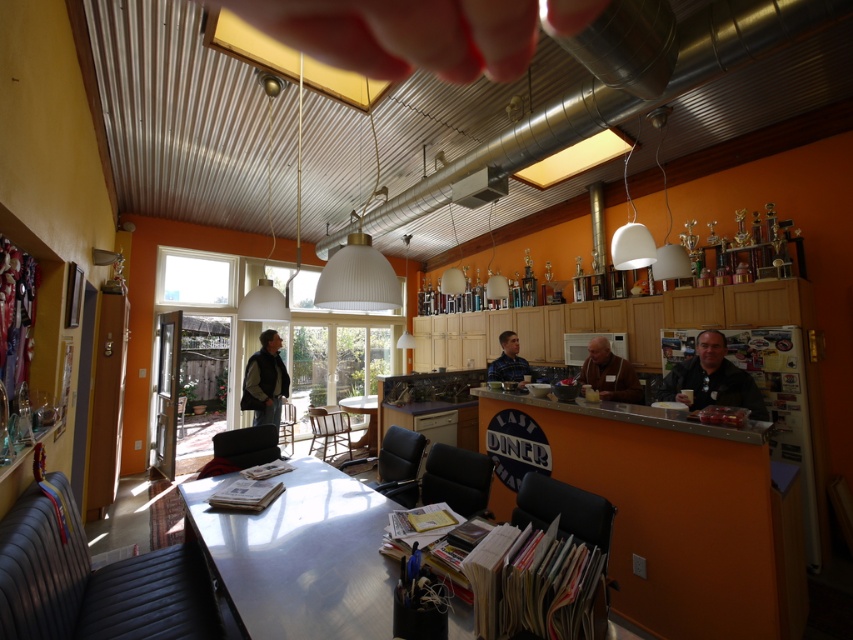
Is dark brown leather jacket at bar counter closer to the viewer compared to blue denim jacket at center?

Yes, dark brown leather jacket at bar counter is closer to the viewer.

Can you confirm if dark brown leather jacket at bar counter is wider than blue denim jacket at center?

Correct, the width of dark brown leather jacket at bar counter exceeds that of blue denim jacket at center.

Identify the location of dark brown leather jacket at bar counter. (711, 378).

Between point (828, 12) and point (709, 385), which one is positioned behind?

The point (709, 385) is behind.

Does silver metallic exhaust hood at upper center have a lesser height compared to dark brown leather jacket at bar counter?

No, silver metallic exhaust hood at upper center is not shorter than dark brown leather jacket at bar counter.

Which is behind, point (331, 240) or point (697, 340)?

The point (331, 240) is behind.

Where is `silver metallic exhaust hood at upper center`? silver metallic exhaust hood at upper center is located at coordinates (621, 96).

Who is positioned more to the right, silver metallic exhaust hood at upper center or blue denim jacket at center?

blue denim jacket at center is more to the right.

Can you confirm if silver metallic exhaust hood at upper center is positioned above blue denim jacket at center?

Yes, silver metallic exhaust hood at upper center is above blue denim jacket at center.

The image size is (853, 640). I want to click on silver metallic exhaust hood at upper center, so click(x=621, y=96).

Identify the location of silver metallic exhaust hood at upper center. (621, 96).